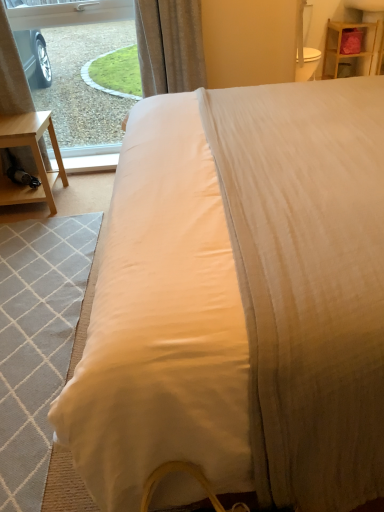
Question: Does light gray woven mat at lower left have a greater height compared to transparent glass window at upper left?

Choices:
 (A) yes
 (B) no

Answer: (B)

Question: From a real-world perspective, is light gray woven mat at lower left over transparent glass window at upper left?

Choices:
 (A) no
 (B) yes

Answer: (A)

Question: Can you confirm if light gray woven mat at lower left is bigger than transparent glass window at upper left?

Choices:
 (A) no
 (B) yes

Answer: (A)

Question: Does light gray woven mat at lower left have a lesser height compared to transparent glass window at upper left?

Choices:
 (A) yes
 (B) no

Answer: (A)

Question: Is light gray woven mat at lower left behind transparent glass window at upper left?

Choices:
 (A) no
 (B) yes

Answer: (A)

Question: Do you think transparent glass window at upper left is within light gray woven mat at lower left, or outside of it?

Choices:
 (A) outside
 (B) inside

Answer: (A)

Question: From a real-world perspective, relative to light gray woven mat at lower left, is transparent glass window at upper left vertically above or below?

Choices:
 (A) below
 (B) above

Answer: (B)

Question: In the image, is transparent glass window at upper left positioned in front of or behind light gray woven mat at lower left?

Choices:
 (A) front
 (B) behind

Answer: (B)

Question: Visually, is transparent glass window at upper left positioned to the left or to the right of light gray woven mat at lower left?

Choices:
 (A) left
 (B) right

Answer: (A)

Question: Considering the positions of light gray woven mat at lower left and satin curtain at upper center in the image, is light gray woven mat at lower left bigger or smaller than satin curtain at upper center?

Choices:
 (A) small
 (B) big

Answer: (A)

Question: Is light gray woven mat at lower left wider or thinner than satin curtain at upper center?

Choices:
 (A) wide
 (B) thin

Answer: (A)

Question: Visually, is light gray woven mat at lower left positioned to the left or to the right of satin curtain at upper center?

Choices:
 (A) left
 (B) right

Answer: (A)

Question: From their relative heights in the image, would you say light gray woven mat at lower left is taller or shorter than satin curtain at upper center?

Choices:
 (A) short
 (B) tall

Answer: (A)

Question: From a real-world perspective, is satin curtain at upper center above or below wooden shelf at upper right?

Choices:
 (A) below
 (B) above

Answer: (B)

Question: From the image's perspective, relative to wooden shelf at upper right, is satin curtain at upper center above or below?

Choices:
 (A) above
 (B) below

Answer: (B)